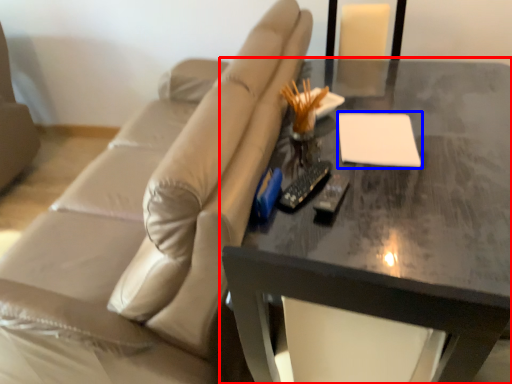
Question: Which of the following is the farthest to the observer, table (highlighted by a red box) or notepad (highlighted by a blue box)?

Choices:
 (A) table
 (B) notepad

Answer: (B)